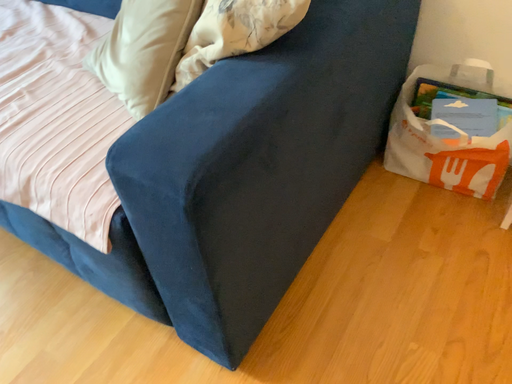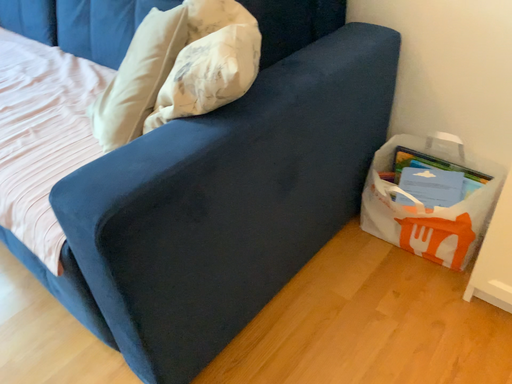
Question: How did the camera likely rotate when shooting the video?

Choices:
 (A) rotated downward
 (B) rotated upward

Answer: (B)